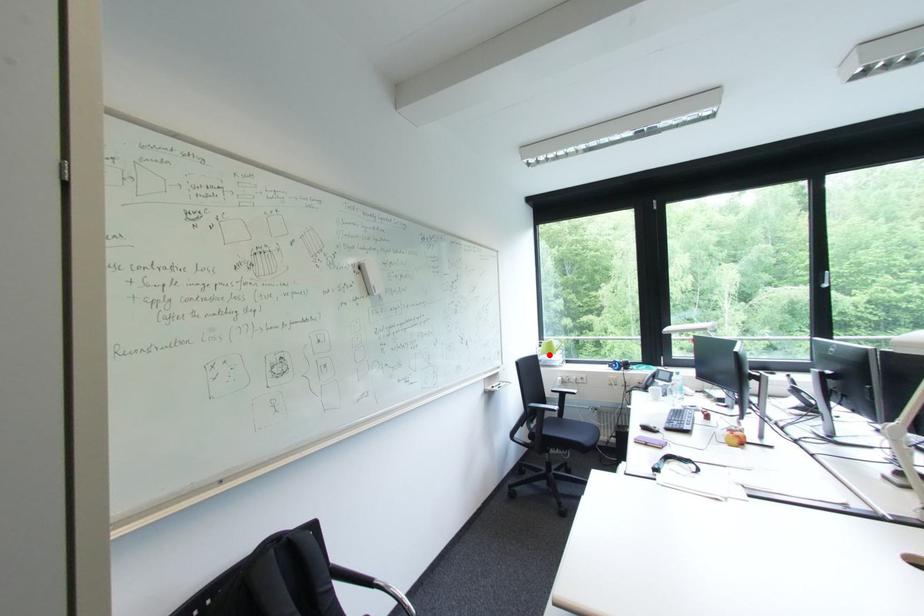
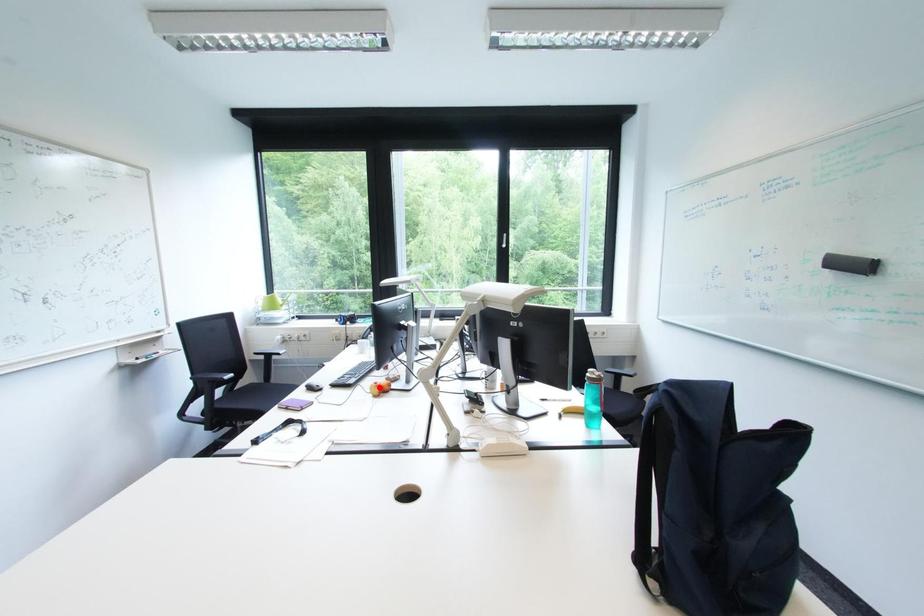
I am providing you with two images of the same scene from different viewpoints. A red point is marked on the first image and another point is marked on the second image. Do the highlighted points in image1 and image2 indicate the same real-world spot?

No